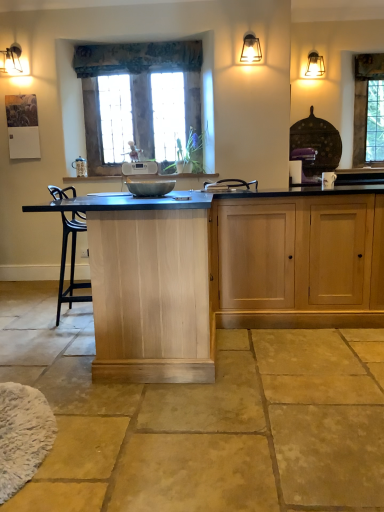
Question: Is textured fabric curtain at upper center in front of or behind matte black wall sconce at upper right in the image?

Choices:
 (A) behind
 (B) front

Answer: (A)

Question: Is textured fabric curtain at upper center spatially inside matte black wall sconce at upper right, or outside of it?

Choices:
 (A) outside
 (B) inside

Answer: (A)

Question: Which of these objects is positioned closest to the natural wood cabinet at center?

Choices:
 (A) wooden window at center, which ranks as the 2th window in back-to-front order
 (B) metallic bowl at center
 (C) white fluffy mat at lower left
 (D) clear glass window at upper right, the 1th window in the right-to-left sequence
 (E) natural stone floor at center

Answer: (E)

Question: Considering the real-world distances, which object is farthest from the clear glass window at upper right, the second window when ordered from left to right?

Choices:
 (A) metallic bowl at center
 (B) textured fabric curtain at upper center
 (C) natural stone floor at center
 (D) white fluffy mat at lower left
 (E) wooden window at center, the 1th window in the left-to-right sequence

Answer: (D)